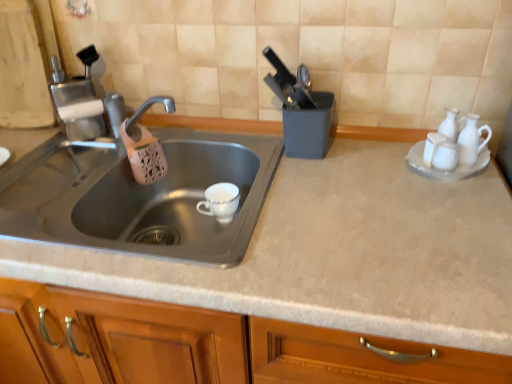
Question: Could stainless steel sink at left be considered to be inside white glossy salt shaker at upper right, arranged as the 2th tableware when viewed from the back?

Choices:
 (A) no
 (B) yes

Answer: (A)

Question: Is white glossy salt shaker at upper right, positioned as the second tableware in front-to-back order, smaller than stainless steel sink at left?

Choices:
 (A) no
 (B) yes

Answer: (B)

Question: Does white glossy salt shaker at upper right, which is the second tableware in left-to-right order, have a greater width compared to stainless steel sink at left?

Choices:
 (A) no
 (B) yes

Answer: (A)

Question: Are white glossy salt shaker at upper right, positioned as the second tableware in front-to-back order, and stainless steel sink at left far apart?

Choices:
 (A) yes
 (B) no

Answer: (B)

Question: Can you confirm if white glossy salt shaker at upper right, positioned as the 2th tableware in right-to-left order, is shorter than stainless steel sink at left?

Choices:
 (A) yes
 (B) no

Answer: (A)

Question: Is the position of white glossy salt shaker at upper right, positioned as the second tableware in front-to-back order, less distant than that of stainless steel sink at left?

Choices:
 (A) no
 (B) yes

Answer: (A)

Question: Can you confirm if matte gray countertop at center is shorter than stainless steel sink at left?

Choices:
 (A) yes
 (B) no

Answer: (B)

Question: From a real-world perspective, is matte gray countertop at center physically above stainless steel sink at left?

Choices:
 (A) yes
 (B) no

Answer: (B)

Question: Can you confirm if matte gray countertop at center is thinner than stainless steel sink at left?

Choices:
 (A) no
 (B) yes

Answer: (A)

Question: Considering the relative sizes of matte gray countertop at center and stainless steel sink at left in the image provided, is matte gray countertop at center wider than stainless steel sink at left?

Choices:
 (A) no
 (B) yes

Answer: (B)

Question: Is matte gray countertop at center looking in the opposite direction of stainless steel sink at left?

Choices:
 (A) no
 (B) yes

Answer: (B)

Question: Is matte gray countertop at center closer to camera compared to stainless steel sink at left?

Choices:
 (A) yes
 (B) no

Answer: (A)

Question: Can you confirm if stainless steel sink at left is taller than white glossy salt shaker at upper right, which is the second tableware in left-to-right order?

Choices:
 (A) no
 (B) yes

Answer: (B)